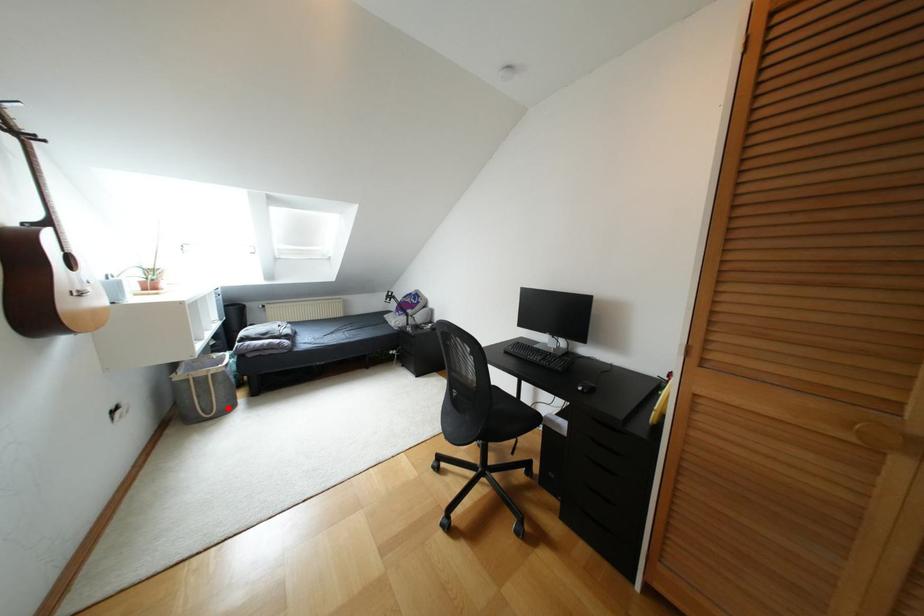
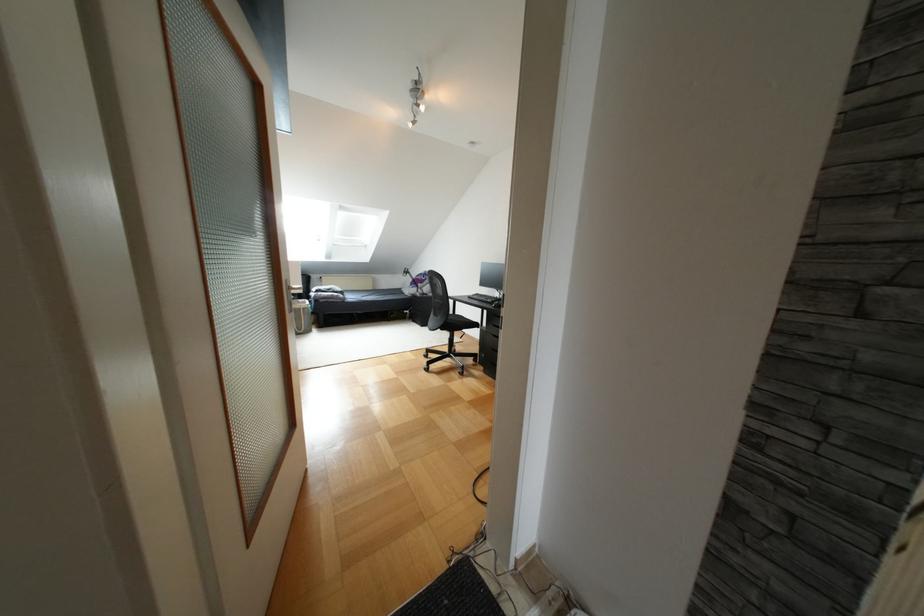
Locate, in the second image, the point that corresponds to the highlighted location in the first image.

(309, 330)